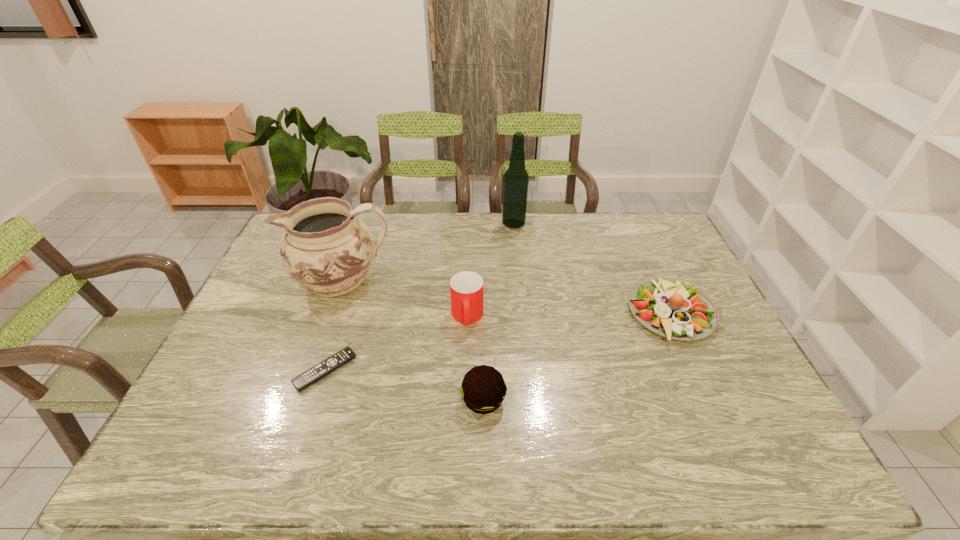
At what (x,y) coordinates should I click in order to perform the action: click on free spot between the pitcher and the fifth object from left to right. Please return your answer as a coordinate pair (x, y). Image resolution: width=960 pixels, height=540 pixels. Looking at the image, I should click on (428, 252).

Locate an element on the screen. The image size is (960, 540). vacant space in between the fifth tallest object and the remote control is located at coordinates (498, 342).

This screenshot has height=540, width=960. In order to click on object that is the third nearest to the pitcher in this screenshot , I will do tap(483, 389).

Where is `the third closest object to the tallest object`? the third closest object to the tallest object is located at coordinates click(x=670, y=309).

This screenshot has width=960, height=540. I want to click on vacant region that satisfies the following two spatial constraints: 1. on the front side of the second object from right to left; 2. on the spout of the pitcher, so click(519, 280).

This screenshot has height=540, width=960. Identify the location of vacant space that satisfies the following two spatial constraints: 1. on the spout of the patty; 2. on the right side of the fifth shortest object. (300, 400).

Where is `free space that satisfies the following two spatial constraints: 1. on the front side of the tallest object; 2. on the spout of the fifth shortest object`? The height and width of the screenshot is (540, 960). free space that satisfies the following two spatial constraints: 1. on the front side of the tallest object; 2. on the spout of the fifth shortest object is located at coordinates (519, 280).